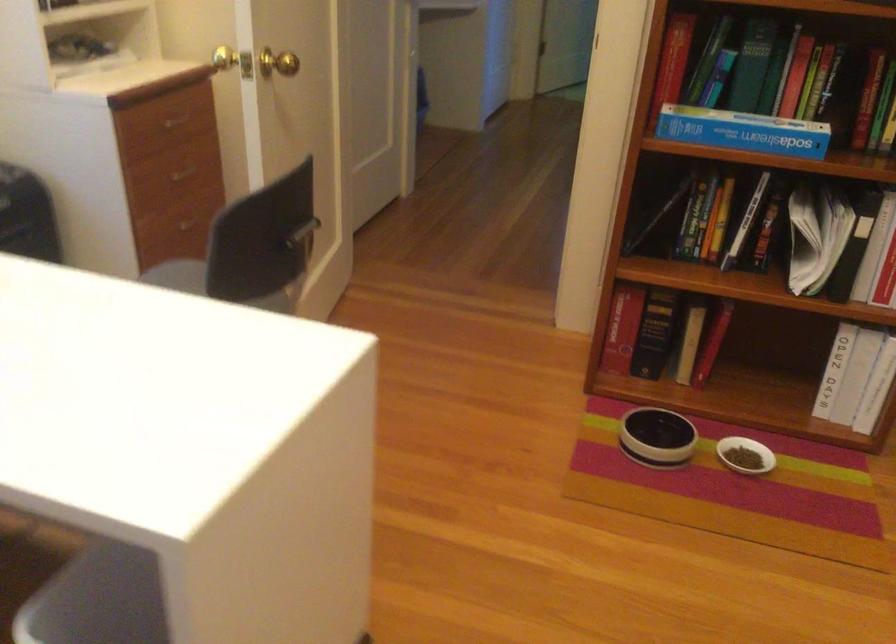
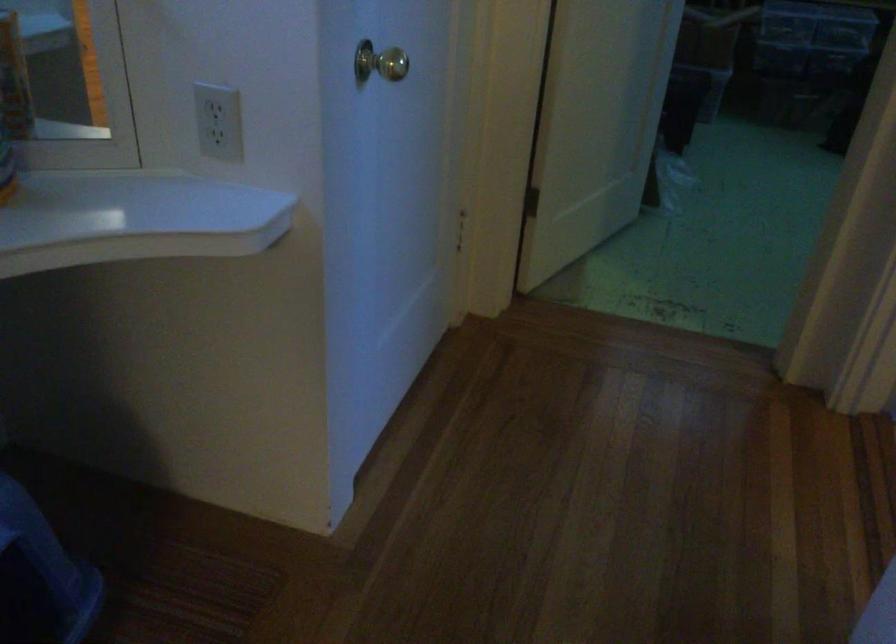
Question: What movement of the cameraman would produce the second image?

Choices:
 (A) Left
 (B) Right
 (C) Forward
 (D) Backward

Answer: (C)